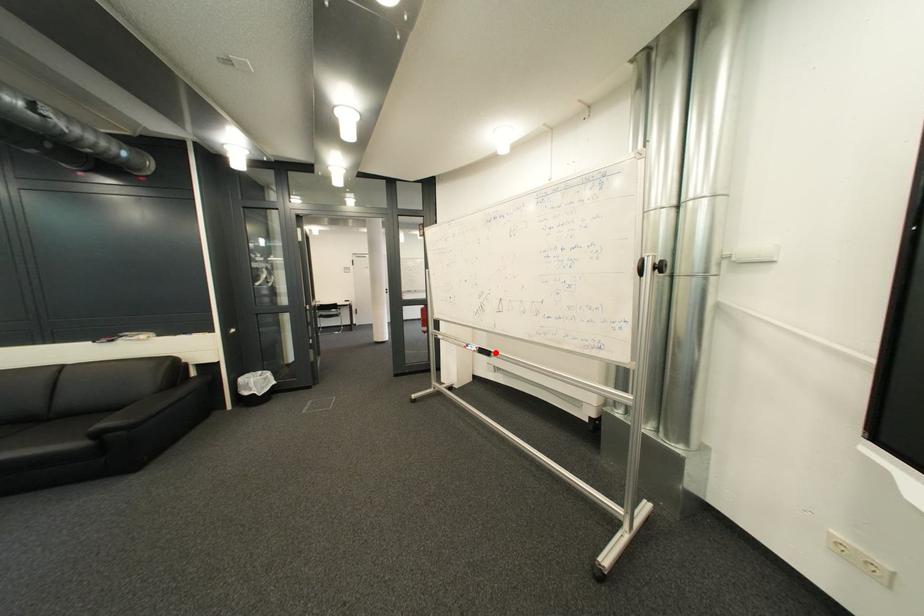
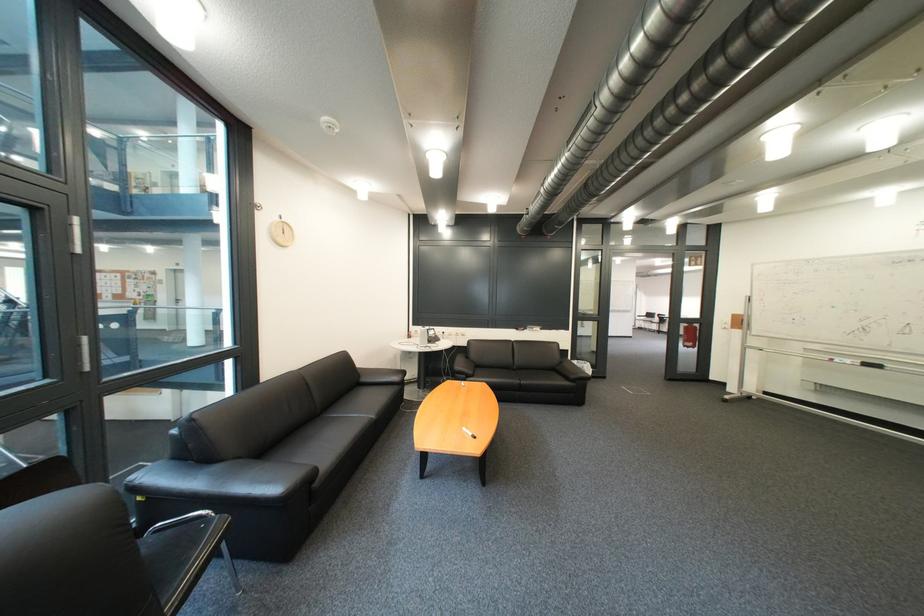
Find the pixel in the second image that matches the highlighted location in the first image.

(881, 366)